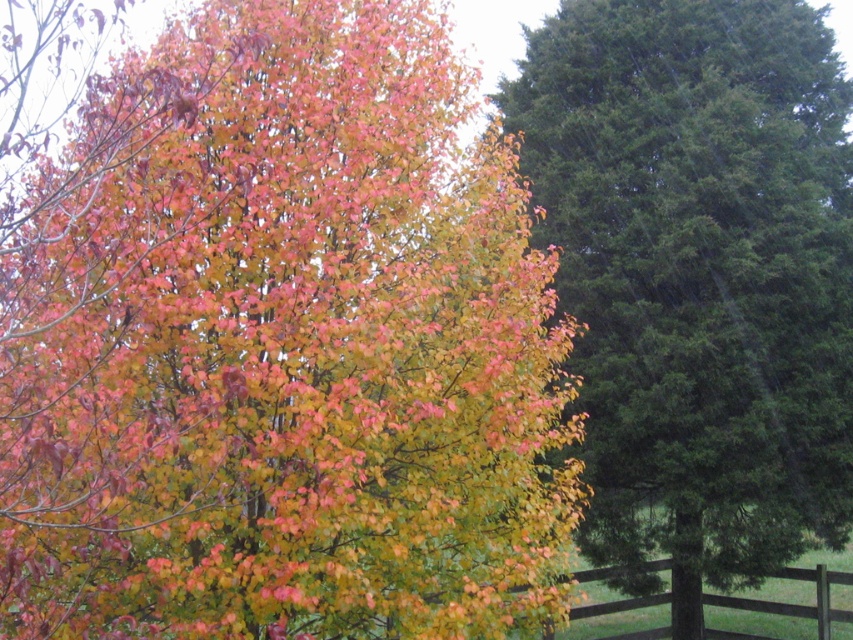
Question: Is green textured pine tree at right positioned before brown wooden fence at lower right?

Choices:
 (A) no
 (B) yes

Answer: (B)

Question: Which point is farther to the camera?

Choices:
 (A) (608, 568)
 (B) (242, 321)

Answer: (A)

Question: Observing the image, what is the correct spatial positioning of green textured pine tree at right in reference to brown wooden fence at lower right?

Choices:
 (A) left
 (B) right

Answer: (A)

Question: Which point appears closest to the camera in this image?

Choices:
 (A) (28, 465)
 (B) (642, 22)
 (C) (610, 604)

Answer: (A)

Question: Which object appears farthest from the camera in this image?

Choices:
 (A) multicolored foliage at center
 (B) brown wooden fence at lower right

Answer: (B)

Question: Does green textured pine tree at right appear over brown wooden fence at lower right?

Choices:
 (A) no
 (B) yes

Answer: (B)